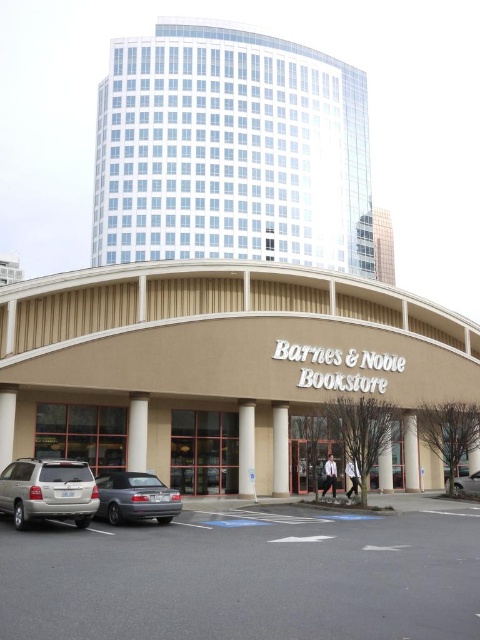
Does matte gray sedan at lower left have a greater width compared to silver metallic sedan at center?

Correct, the width of matte gray sedan at lower left exceeds that of silver metallic sedan at center.

Between matte gray sedan at lower left and silver metallic sedan at center, which one has more height?

Standing taller between the two is matte gray sedan at lower left.

This screenshot has width=480, height=640. Describe the element at coordinates (135, 497) in the screenshot. I see `matte gray sedan at lower left` at that location.

I want to click on matte gray sedan at lower left, so click(135, 497).

Can you confirm if silver metallic suv at lower left is positioned to the left of matte gray sedan at lower left?

Correct, you'll find silver metallic suv at lower left to the left of matte gray sedan at lower left.

I want to click on silver metallic suv at lower left, so click(x=48, y=490).

You are a GUI agent. You are given a task and a screenshot of the screen. Output one action in this format:
    pyautogui.click(x=<x>, y=<y>)
    Task: Click on the silver metallic suv at lower left
    Image resolution: width=480 pixels, height=640 pixels.
    Given the screenshot: What is the action you would take?
    pyautogui.click(x=48, y=490)

Between silver metallic suv at lower left and silver metallic sedan at center, which one is positioned higher?

silver metallic suv at lower left

Can you confirm if silver metallic suv at lower left is positioned above silver metallic sedan at center?

Correct, silver metallic suv at lower left is located above silver metallic sedan at center.

Is point (20, 472) farther from viewer compared to point (469, 488)?

No, it is in front of (469, 488).

Find the location of a particular element. silver metallic suv at lower left is located at coordinates (48, 490).